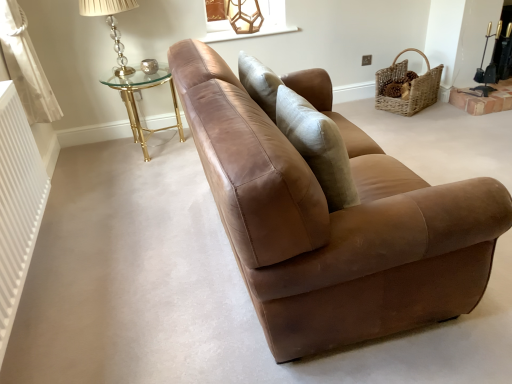
Question: Considering the positions of point (392, 79) and point (2, 0), is point (392, 79) closer or farther from the camera than point (2, 0)?

Choices:
 (A) closer
 (B) farther

Answer: (B)

Question: From the image's perspective, is woven natural basket at upper right positioned above or below white fabric curtain at left?

Choices:
 (A) above
 (B) below

Answer: (A)

Question: Based on their relative distances, which object is farther from the translucent glass lampshade at upper left, the 2th table lamp positioned from the right?

Choices:
 (A) metallic glass table lamp at upper center, the 2th table lamp viewed from the left
 (B) white ribbed radiator at left
 (C) brown leather couch at center
 (D) woven natural basket at upper right
 (E) white fabric curtain at left

Answer: (D)

Question: Which object is the closest to the gold metallic glass table at upper left?

Choices:
 (A) metallic glass table lamp at upper center, the second table lamp positioned from the front
 (B) translucent glass lampshade at upper left, the second table lamp when ordered from back to front
 (C) white fabric curtain at left
 (D) brown leather couch at center
 (E) woven natural basket at upper right

Answer: (B)